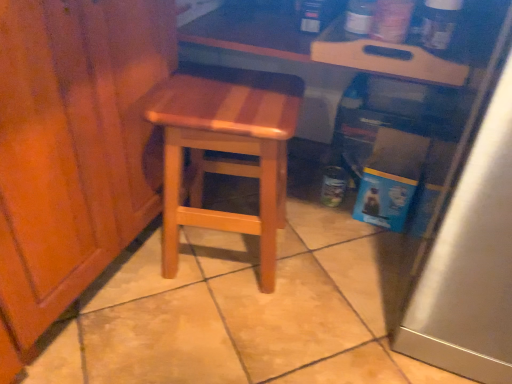
Identify the location of free space in front of natural wood stool at center. The width and height of the screenshot is (512, 384). (212, 331).